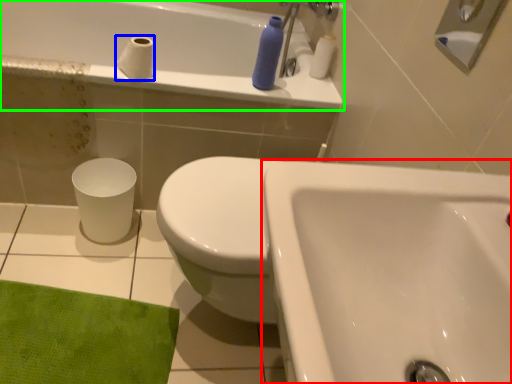
Question: Based on their relative distances, which object is nearer to sink (highlighted by a red box)? Choose from toilet paper (highlighted by a blue box) and bathtub (highlighted by a green box).

Choices:
 (A) toilet paper
 (B) bathtub

Answer: (A)